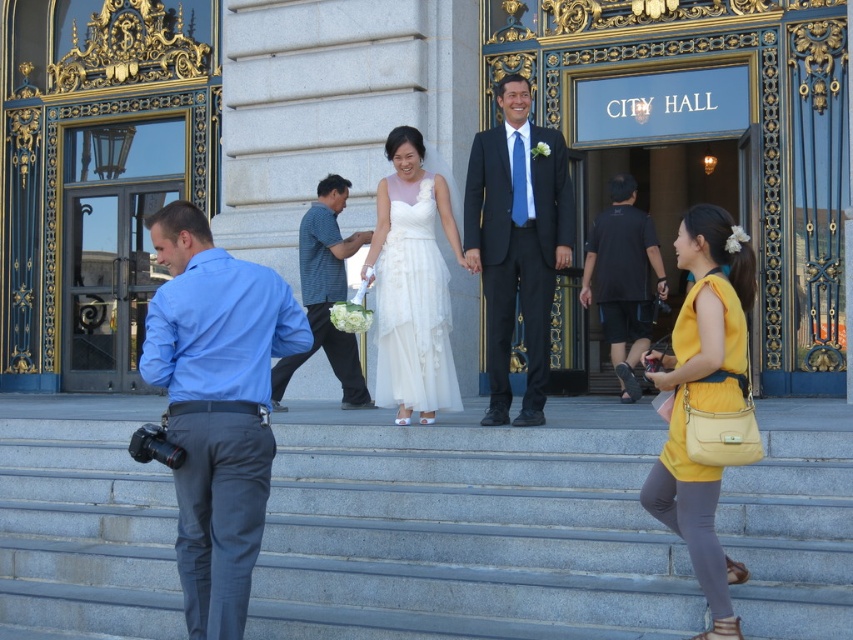
Does gray stone stairs at center appear on the left side of white satin dress at center?

Correct, you'll find gray stone stairs at center to the left of white satin dress at center.

Is gray stone stairs at center closer to the viewer compared to white satin dress at center?

No.

Who is more forward, (422, 483) or (521, 227)?

Point (422, 483) is in front.

What are the coordinates of `gray stone stairs at center` in the screenshot? It's located at (469, 532).

Looking at this image, between white satin dress at center and striped cotton shirt at center, which one has less height?

Standing shorter between the two is striped cotton shirt at center.

Looking at this image, between white satin dress at center and striped cotton shirt at center, which one appears on the right side from the viewer's perspective?

Positioned to the right is white satin dress at center.

At what (x,y) coordinates should I click in order to perform the action: click on white satin dress at center. Please return your answer as a coordinate pair (x, y). Looking at the image, I should click on (704, 404).

Is black cotton t-shirt at center positioned in front of striped cotton shirt at center?

No, it is behind striped cotton shirt at center.

Identify the location of black cotton t-shirt at center. (624, 280).